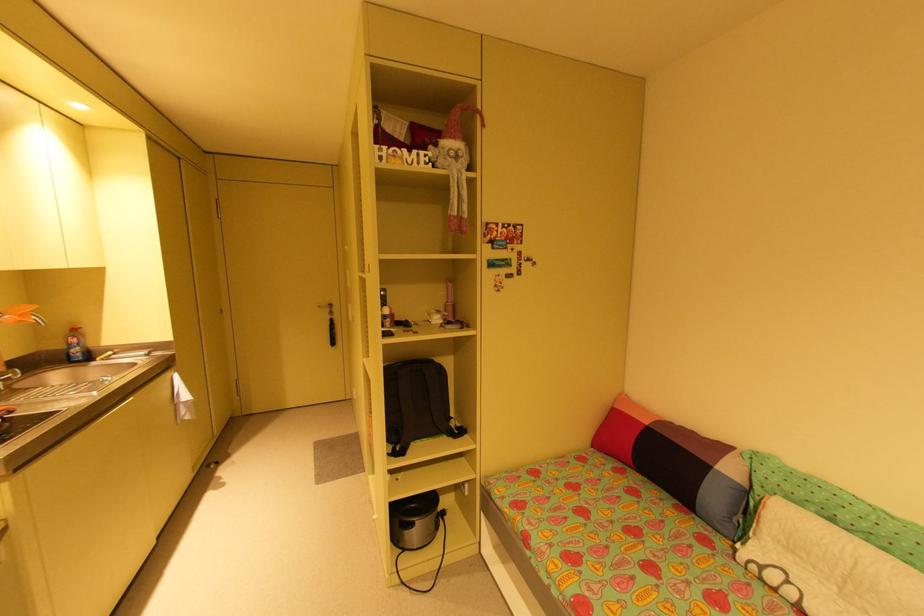
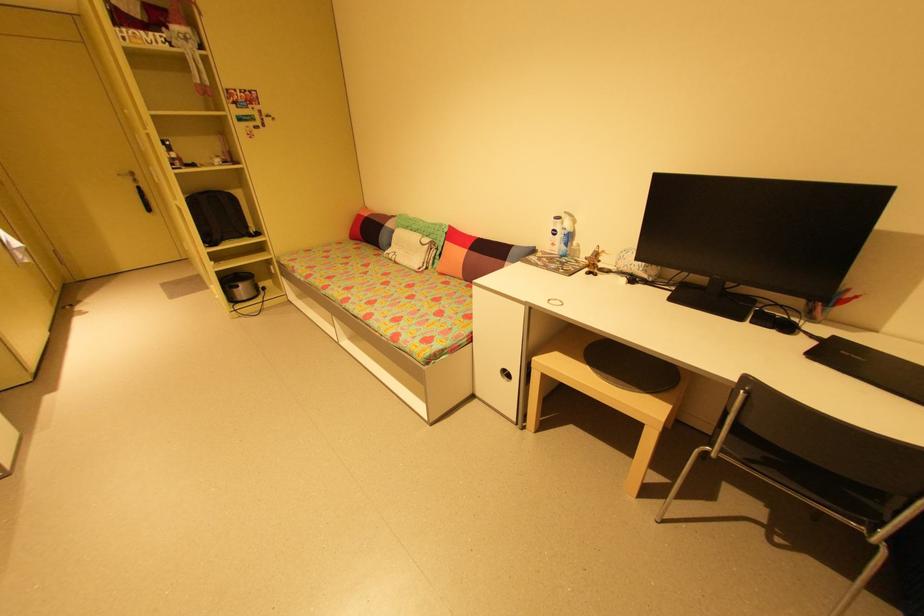
In the second image, find the point that corresponds to pixel 333 323 in the first image.

(140, 191)